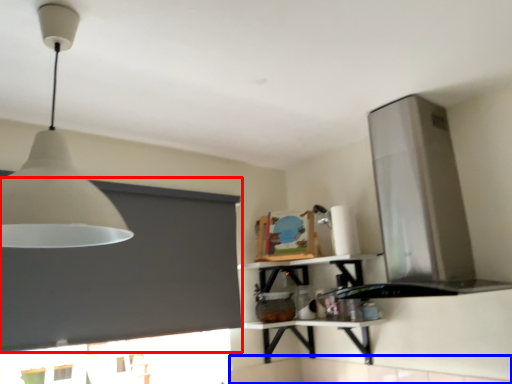
Question: Among these objects, which one is farthest to the camera, window screen (highlighted by a red box) or counter top (highlighted by a blue box)?

Choices:
 (A) window screen
 (B) counter top

Answer: (B)